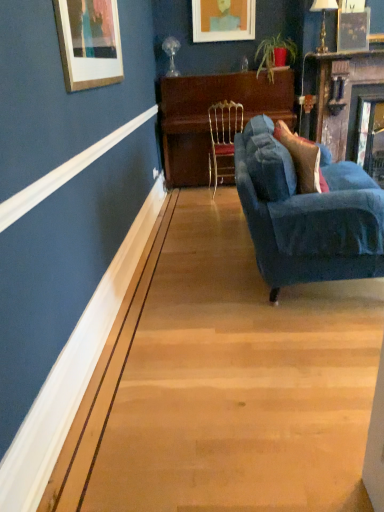
Question: From a real-world perspective, relative to matte orange picture frame at upper center, is wooden piano at center vertically above or below?

Choices:
 (A) above
 (B) below

Answer: (B)

Question: Is wooden piano at center to the left or to the right of matte orange picture frame at upper center in the image?

Choices:
 (A) right
 (B) left

Answer: (A)

Question: Which of these objects is positioned closest to the gold wire chair at center?

Choices:
 (A) wooden piano at center
 (B) wooden mantel at upper right
 (C) matte orange picture frame at upper center
 (D) velvet blue pillow at right
 (E) velvet blue couch at right

Answer: (A)

Question: Estimate the real-world distances between objects in this image. Which object is closer to the wooden piano at center?

Choices:
 (A) wooden mantel at upper right
 (B) gold wire chair at center
 (C) velvet blue couch at right
 (D) matte orange picture frame at upper center
 (E) velvet blue pillow at right

Answer: (B)